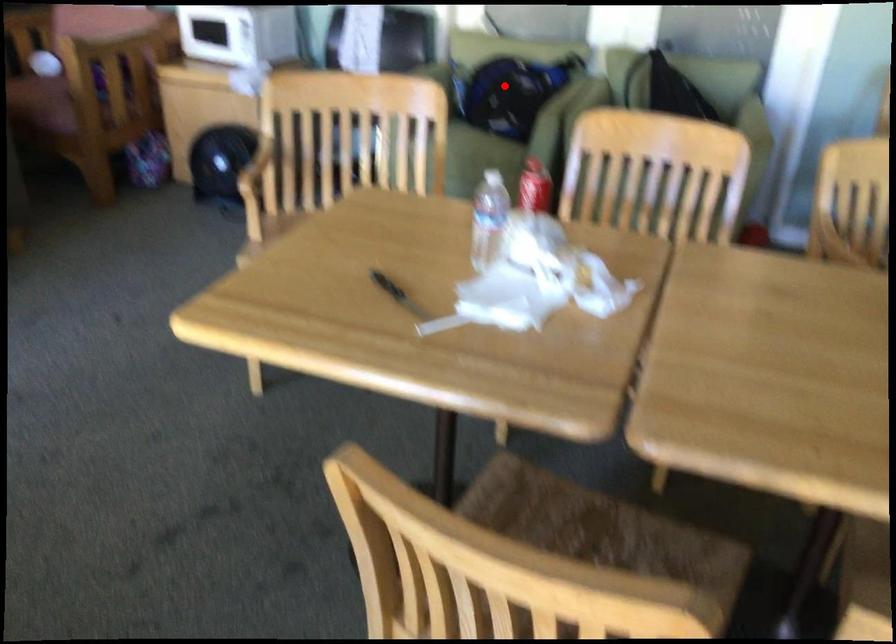
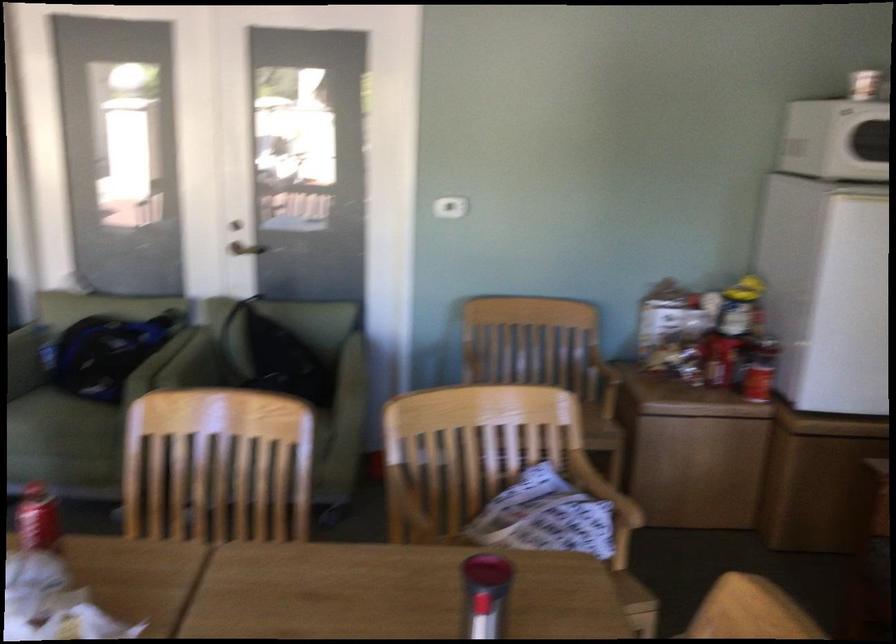
In the second image, find the point that corresponds to the highlighted location in the first image.

(104, 354)